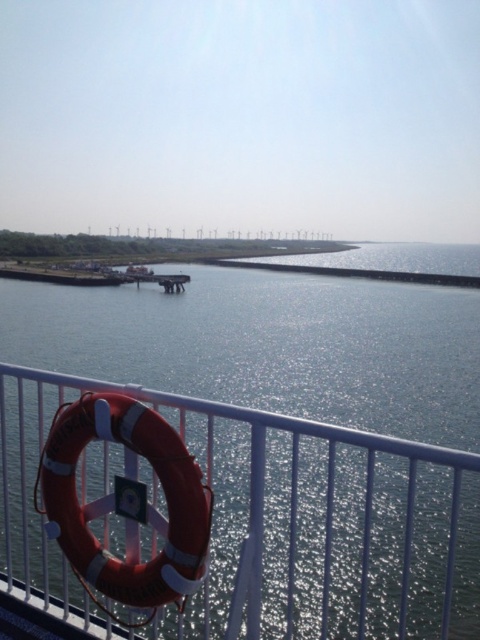
You are standing on the deck of a ship and notice the white metal fence at lower center and the rubber life ring at lower left. Which object is closer to your feet?

The white metal fence at lower center is positioned under the rubber life ring at lower left, so the white metal fence at lower center is closer to your feet.

You are a maintenance worker assigned to inspect the white metal fence at lower center. Your tool box is placed 2 meters away from the fence. Can you reach your toolbox without moving from your current position?

The white metal fence at lower center is 2.14 meters away from the toolbox. Since the distance between them is slightly more than 2 meters, you cannot reach the toolbox without moving.